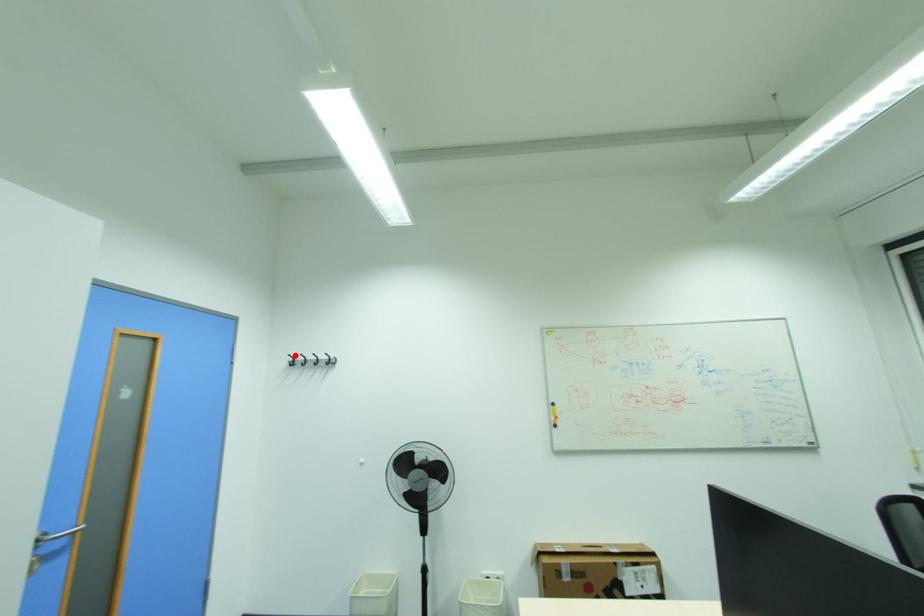
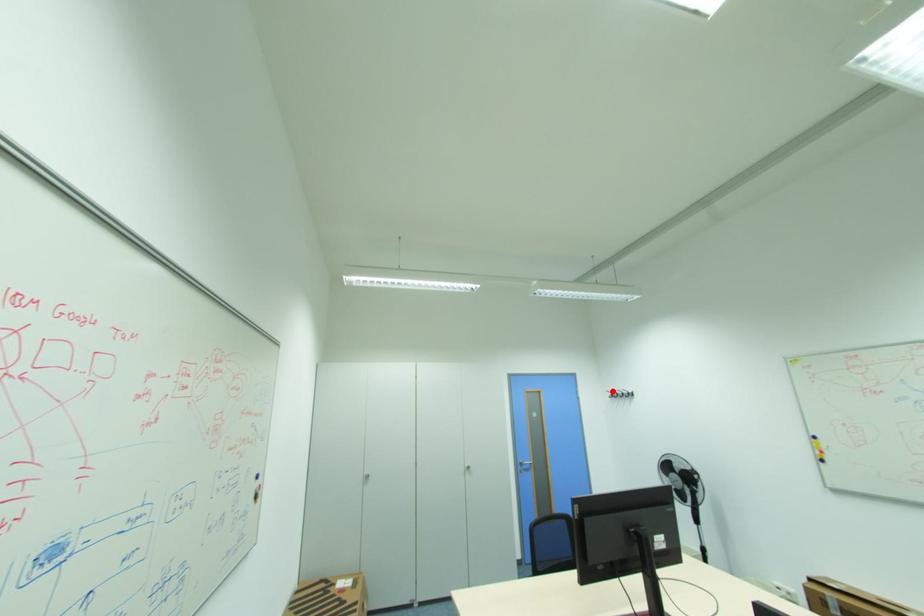
I am providing you with two images of the same scene from different viewpoints. A red point is marked on the first image and another point is marked on the second image. Is the marked point in image1 the same physical position as the marked point in image2?

Yes